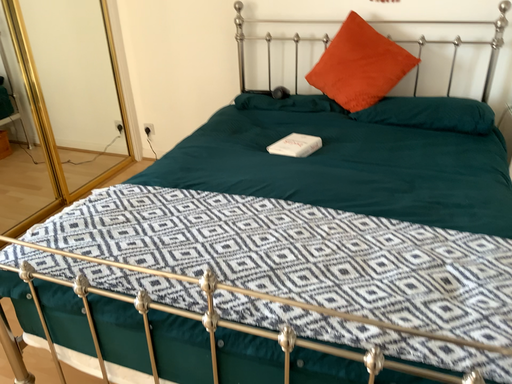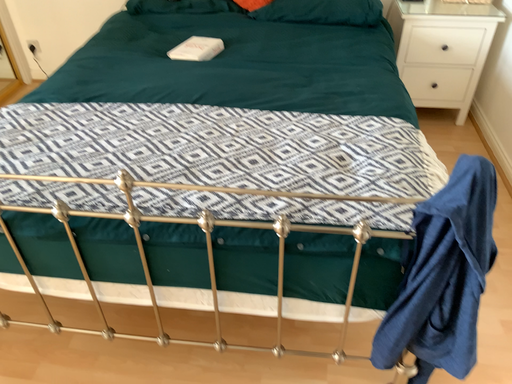
Question: Which way did the camera rotate in the video?

Choices:
 (A) rotated upward
 (B) rotated downward

Answer: (B)